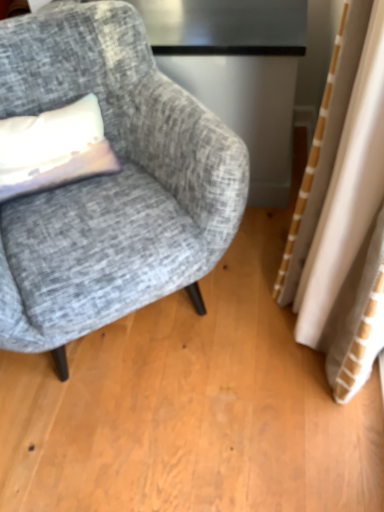
Question: From a real-world perspective, is matte white pillow at left physically located above or below textured gray fabric chair at left?

Choices:
 (A) above
 (B) below

Answer: (A)

Question: Is matte white pillow at left to the left or to the right of textured gray fabric chair at left in the image?

Choices:
 (A) left
 (B) right

Answer: (A)

Question: Do you think matte white pillow at left is within textured gray fabric chair at left, or outside of it?

Choices:
 (A) outside
 (B) inside

Answer: (B)

Question: Would you say textured gray fabric chair at left is to the left or to the right of matte white pillow at left in the picture?

Choices:
 (A) right
 (B) left

Answer: (A)

Question: Do you think textured gray fabric chair at left is within matte white pillow at left, or outside of it?

Choices:
 (A) outside
 (B) inside

Answer: (A)

Question: From a real-world perspective, is textured gray fabric chair at left above or below matte white pillow at left?

Choices:
 (A) below
 (B) above

Answer: (A)

Question: Is textured gray fabric chair at left bigger or smaller than matte white pillow at left?

Choices:
 (A) small
 (B) big

Answer: (B)